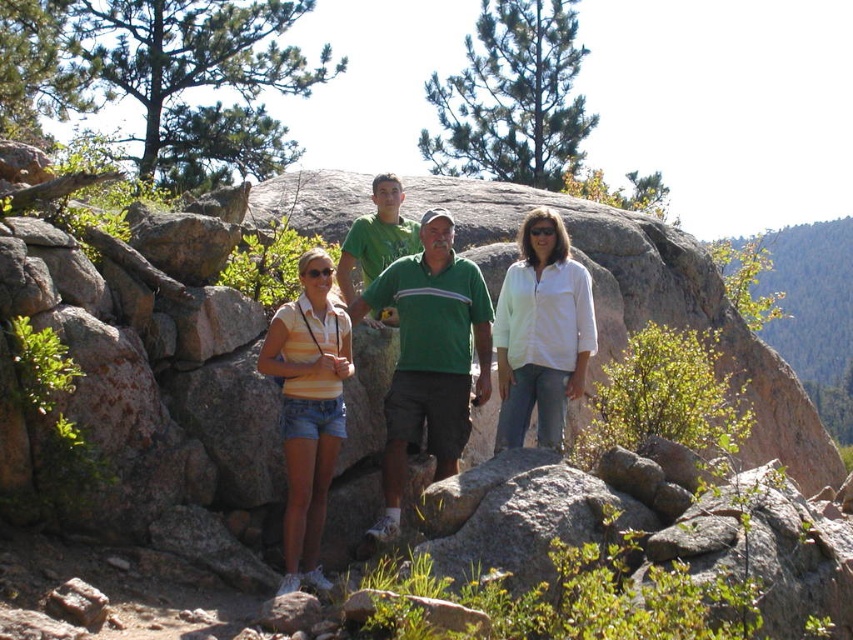
Does green cotton polo shirt at center have a lesser width compared to green cotton shirt at center?

Incorrect, green cotton polo shirt at center's width is not less than green cotton shirt at center's.

Between green cotton polo shirt at center and green cotton shirt at center, which one is positioned higher?

green cotton shirt at center

The width and height of the screenshot is (853, 640). What are the coordinates of `green cotton polo shirt at center` in the screenshot? It's located at (428, 355).

Find the location of a particular element. green cotton polo shirt at center is located at coordinates (428, 355).

Who is taller, striped cotton shirt at center or green cotton polo shirt at center?

striped cotton shirt at center

Is striped cotton shirt at center further to camera compared to green cotton polo shirt at center?

Yes, it is.

I want to click on striped cotton shirt at center, so click(x=428, y=355).

Locate an element on the screen. The height and width of the screenshot is (640, 853). striped cotton shirt at center is located at coordinates (428, 355).

Between point (436, 380) and point (413, 234), which one is positioned behind?

The point (413, 234) is more distant.

Who is more distant from viewer, (x=305, y=282) or (x=389, y=256)?

Point (x=389, y=256)

The width and height of the screenshot is (853, 640). Identify the location of striped cotton shirt at center. (428, 355).